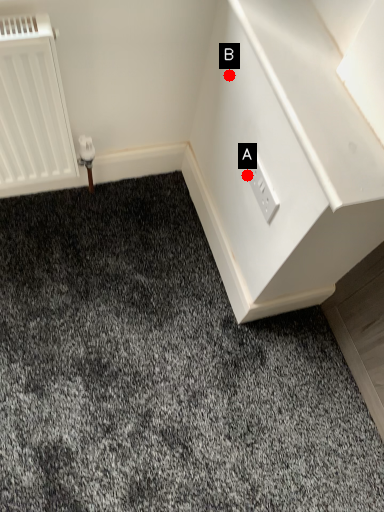
Question: Two points are circled on the image, labeled by A and B beside each circle. Which point appears farthest from the camera in this image?

Choices:
 (A) A is further
 (B) B is further

Answer: (A)